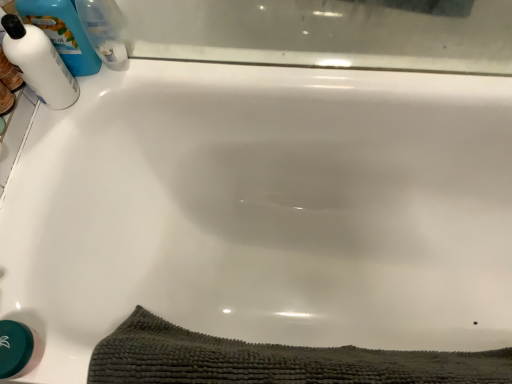
Where is `vacant area that is in front of white glossy bottle at upper left, the 2th cleaning product in the left-to-right sequence`? Image resolution: width=512 pixels, height=384 pixels. vacant area that is in front of white glossy bottle at upper left, the 2th cleaning product in the left-to-right sequence is located at coordinates (61, 113).